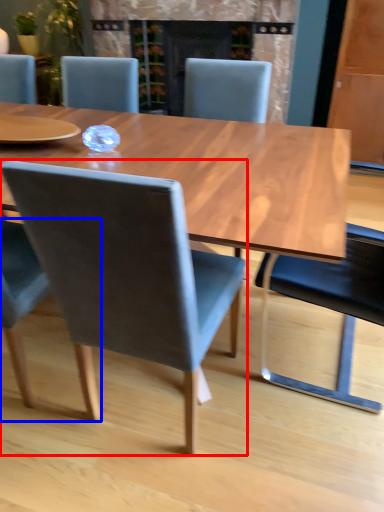
Question: Which object is closer to the camera taking this photo, chair (highlighted by a red box) or chair (highlighted by a blue box)?

Choices:
 (A) chair
 (B) chair

Answer: (A)